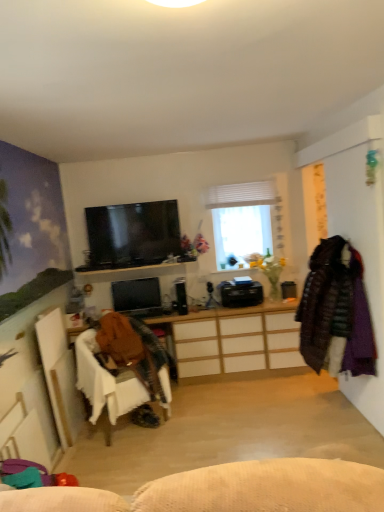
Question: Are wooden desk at center and matte black monitor at center, the 1th television viewed from the back, beside each other?

Choices:
 (A) yes
 (B) no

Answer: (B)

Question: Is wooden desk at center completely or partially outside of matte black monitor at center, positioned as the first television in bottom-to-top order?

Choices:
 (A) yes
 (B) no

Answer: (A)

Question: Can you confirm if wooden desk at center is positioned to the left of matte black monitor at center, which is counted as the 2th television, starting from the front?

Choices:
 (A) no
 (B) yes

Answer: (A)

Question: Is the position of wooden desk at center more distant than that of matte black monitor at center, which is counted as the 2th television, starting from the front?

Choices:
 (A) yes
 (B) no

Answer: (B)

Question: Is wooden desk at center at the right side of matte black monitor at center, which is counted as the 2th television, starting from the front?

Choices:
 (A) yes
 (B) no

Answer: (A)

Question: Considering the positions of wooden desk at center and black glossy tv at upper center, positioned as the first television in front-to-back order, in the image, is wooden desk at center bigger or smaller than black glossy tv at upper center, positioned as the first television in front-to-back order,?

Choices:
 (A) small
 (B) big

Answer: (B)

Question: In terms of height, does wooden desk at center look taller or shorter compared to black glossy tv at upper center, the 1th television in the top-to-bottom sequence?

Choices:
 (A) tall
 (B) short

Answer: (A)

Question: Is point (297, 324) closer or farther from the camera than point (134, 250)?

Choices:
 (A) farther
 (B) closer

Answer: (B)

Question: From a real-world perspective, is wooden desk at center positioned above or below black glossy tv at upper center, the 1th television in the top-to-bottom sequence?

Choices:
 (A) above
 (B) below

Answer: (B)

Question: From their relative heights in the image, would you say velvet purple coat at right is taller or shorter than white matte window at center?

Choices:
 (A) short
 (B) tall

Answer: (B)

Question: Based on their sizes in the image, would you say velvet purple coat at right is bigger or smaller than white matte window at center?

Choices:
 (A) big
 (B) small

Answer: (A)

Question: In the image, is velvet purple coat at right on the left side or the right side of white matte window at center?

Choices:
 (A) left
 (B) right

Answer: (B)

Question: In the image, is velvet purple coat at right positioned in front of or behind white matte window at center?

Choices:
 (A) front
 (B) behind

Answer: (A)

Question: Is matte black monitor at center, the 1th television viewed from the back, inside the boundaries of dark brown quilted coat at right, marked as the first clothing in a right-to-left arrangement, or outside?

Choices:
 (A) outside
 (B) inside

Answer: (A)

Question: Considering the positions of matte black monitor at center, positioned as the first television in bottom-to-top order, and dark brown quilted coat at right, marked as the first clothing in a right-to-left arrangement, in the image, is matte black monitor at center, positioned as the first television in bottom-to-top order, wider or thinner than dark brown quilted coat at right, marked as the first clothing in a right-to-left arrangement,?

Choices:
 (A) wide
 (B) thin

Answer: (B)